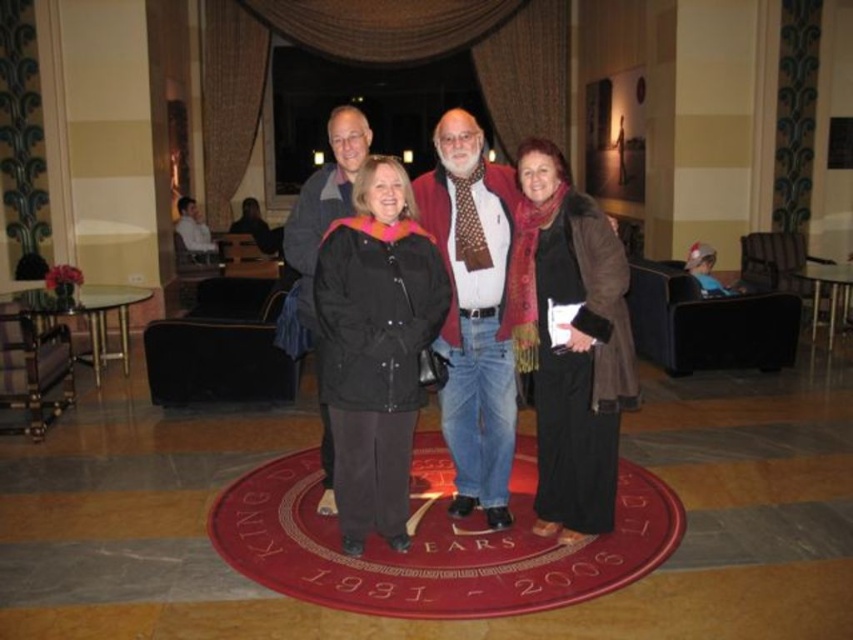
You are a photographer at the event and need to ensure all attendees are visible in the group photo. The red wool sweater at center and the black jacket at center are overlapping slightly. Which clothing item should you ask the person to adjust so that more of their face is visible?

The red wool sweater at center is larger in size than the black jacket at center, so adjusting the red wool sweater at center would allow more of the person face to be visible.

You are standing in the hotel lobby and want to reach the point marked at coordinates (595, 300). If you take a step forward of 1 meter, how far will you be from that point?

The point marked at coordinates (595, 300) is 3.36 meters away from you. After taking a 1 meter step forward, you will be 2.36 meters away from the point.